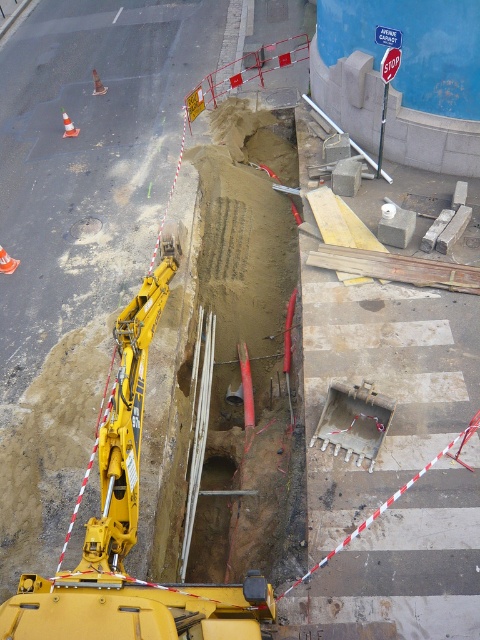
Question: Can you confirm if yellow metallic excavator at center is positioned to the left of smooth concrete hole at center?

Choices:
 (A) yes
 (B) no

Answer: (B)

Question: Can you confirm if yellow metallic excavator at center is positioned to the right of smooth concrete hole at center?

Choices:
 (A) yes
 (B) no

Answer: (A)

Question: Which of the following is the closest to the observer?

Choices:
 (A) [x=178, y=625]
 (B) [x=79, y=237]

Answer: (A)

Question: Which point is closer to the camera?

Choices:
 (A) yellow metallic excavator at center
 (B) smooth concrete hole at center

Answer: (A)

Question: Can you confirm if yellow metallic excavator at center is thinner than smooth concrete hole at center?

Choices:
 (A) yes
 (B) no

Answer: (B)